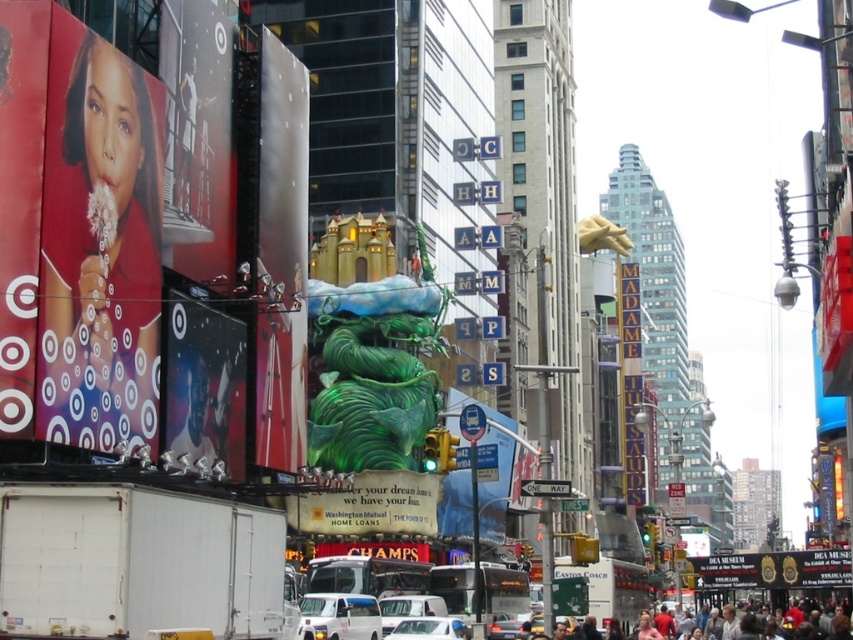
You are a delivery person trying to find the Target store. You see the blue glossy bus stop sign at center and the black glossy sign at center. Which sign is taller and can help you determine the direction to the Target store?

The blue glossy bus stop sign at center is much taller than the black glossy sign at center, so the taller blue glossy bus stop sign at center can help you determine the direction to the Target store.

Consider the image. You are a tourist in Times Square holding a camera. You want to take a photo of both the green glossy dragon at center and the blue glossy bus stop sign at center without any obstructions. Based on their positions, which object should you position closer to the camera to ensure both are fully visible in the frame?

The green glossy dragon at center is closer to the viewer than the blue glossy bus stop sign at center. To capture both without obstructions, position the camera closer to the dragon so it doesn not block the bus stop sign behind it.

You are a photographer trying to capture both the white matte car at center and the metallic silver car at center in a single frame. Which car should you focus on first to ensure both are in the shot?

The white matte car at center is bigger than the metallic silver car at center, so focusing on the white matte car at center first will help ensure both are in the shot since it occupies more space in the frame.